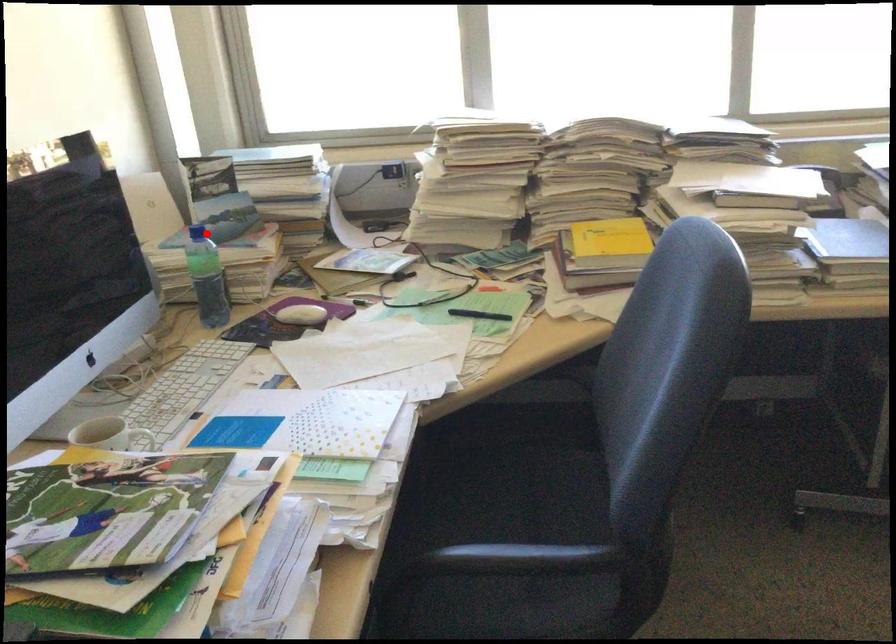
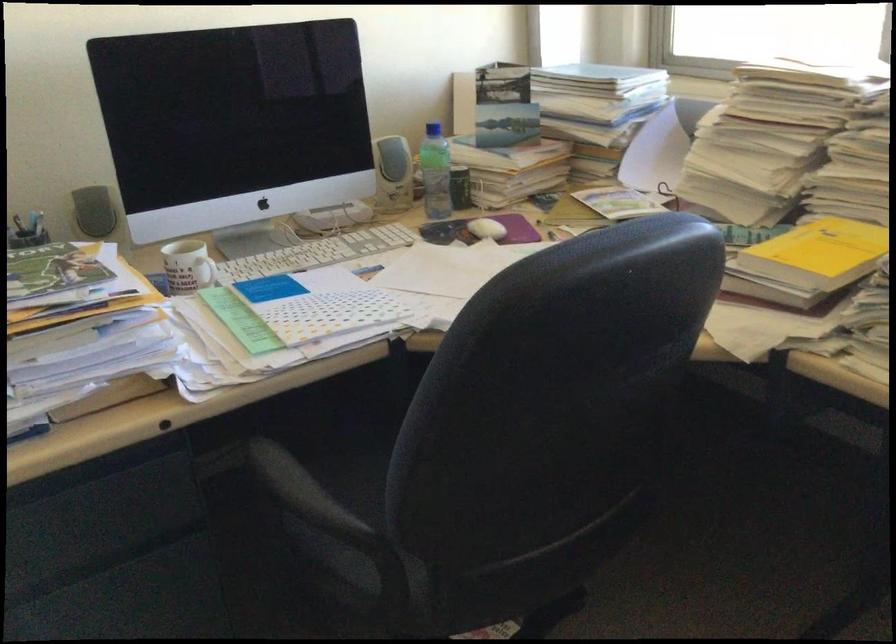
Question: I am providing you with two images of the same scene from different viewpoints. A red point is marked on the first image. Is the red point's position out of view in image 2?

Choices:
 (A) Yes
 (B) No

Answer: (B)